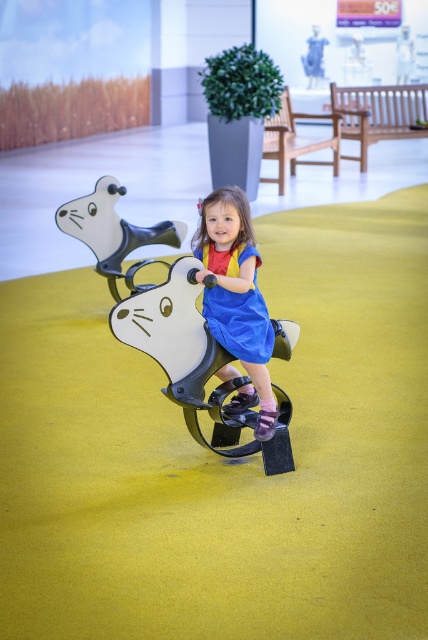
Is blue cotton dress at center bigger than metallic silver bear at center?

Actually, blue cotton dress at center might be smaller than metallic silver bear at center.

Can you confirm if blue cotton dress at center is positioned above metallic silver bear at center?

No.

Where is `blue cotton dress at center`? This screenshot has height=640, width=428. blue cotton dress at center is located at coordinates (237, 298).

Locate an element on the screen. The height and width of the screenshot is (640, 428). blue cotton dress at center is located at coordinates (237, 298).

Where is `metallic silver bear at center`? metallic silver bear at center is located at coordinates (113, 232).

Is metallic silver bear at center to the right of blue satin dress at center from the viewer's perspective?

No, metallic silver bear at center is not to the right of blue satin dress at center.

In the scene shown: Who is more distant from viewer, (61, 212) or (259, 316)?

Point (61, 212)

At what (x,y) coordinates should I click in order to perform the action: click on metallic silver bear at center. Please return your answer as a coordinate pair (x, y). Looking at the image, I should click on (113, 232).

Which is more to the left, blue cotton dress at center or blue satin dress at center?

From the viewer's perspective, blue cotton dress at center appears more on the left side.

Which is more to the right, blue cotton dress at center or blue satin dress at center?

blue satin dress at center is more to the right.

Locate an element on the screen. blue cotton dress at center is located at coordinates (237, 298).

Image resolution: width=428 pixels, height=640 pixels. Find the location of `blue cotton dress at center`. blue cotton dress at center is located at coordinates (237, 298).